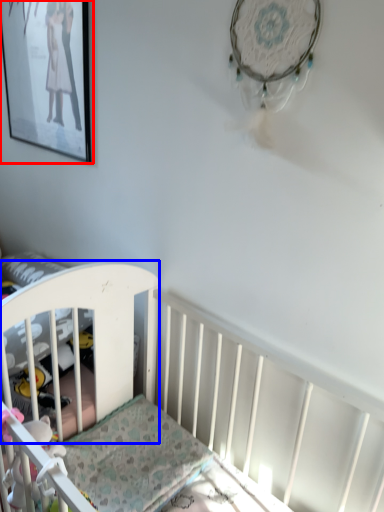
Question: Which object appears closest to the camera in this image, picture frame (highlighted by a red box) or infant bed (highlighted by a blue box)?

Choices:
 (A) picture frame
 (B) infant bed

Answer: (B)